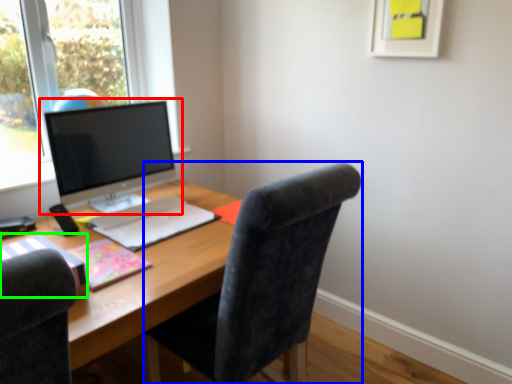
Question: Which is farther away from computer monitor (highlighted by a red box)? chair (highlighted by a blue box) or notebook (highlighted by a green box)?

Choices:
 (A) chair
 (B) notebook

Answer: (A)